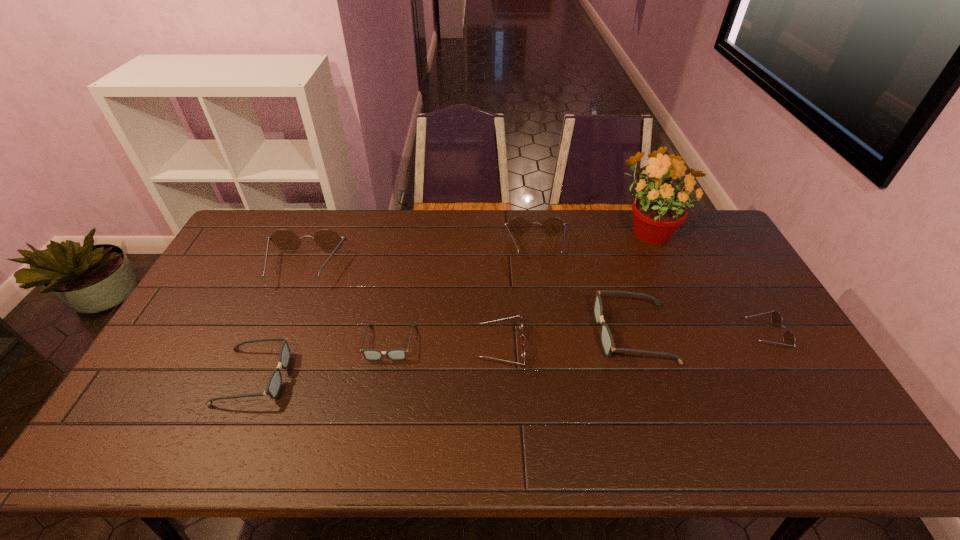
Locate which spectacles is the fourth closest to the leftmost gray spectacles. Please provide its 2D coordinates. Your answer should be formatted as a tuple, i.e. [(x, y)], where the tuple contains the x and y coordinates of a point satisfying the conditions above.

[(518, 226)]

Select which spectacles appears as the closest to the biggest gray spectacles. Please provide its 2D coordinates. Your answer should be formatted as a tuple, i.e. [(x, y)], where the tuple contains the x and y coordinates of a point satisfying the conditions above.

[(518, 226)]

Identify which yellow spectacles is the second closest to the second gray spectacles from left to right. Please provide its 2D coordinates. Your answer should be formatted as a tuple, i.e. [(x, y)], where the tuple contains the x and y coordinates of a point satisfying the conditions above.

[(329, 240)]

Locate which yellow spectacles is the second closest to the third biggest yellow spectacles. Please provide its 2D coordinates. Your answer should be formatted as a tuple, i.e. [(x, y)], where the tuple contains the x and y coordinates of a point satisfying the conditions above.

[(329, 240)]

The width and height of the screenshot is (960, 540). Find the location of `the second closest gray spectacles to the third smallest yellow spectacles`. the second closest gray spectacles to the third smallest yellow spectacles is located at coordinates (369, 354).

Locate an element on the screen. The width and height of the screenshot is (960, 540). gray spectacles that is the second closest to the second smallest yellow spectacles is located at coordinates (607, 342).

Locate an element on the screen. The width and height of the screenshot is (960, 540). free location that satisfies the following two spatial constraints: 1. on the front-facing side of the third smallest yellow spectacles; 2. on the front-facing side of the third biggest yellow spectacles is located at coordinates (551, 348).